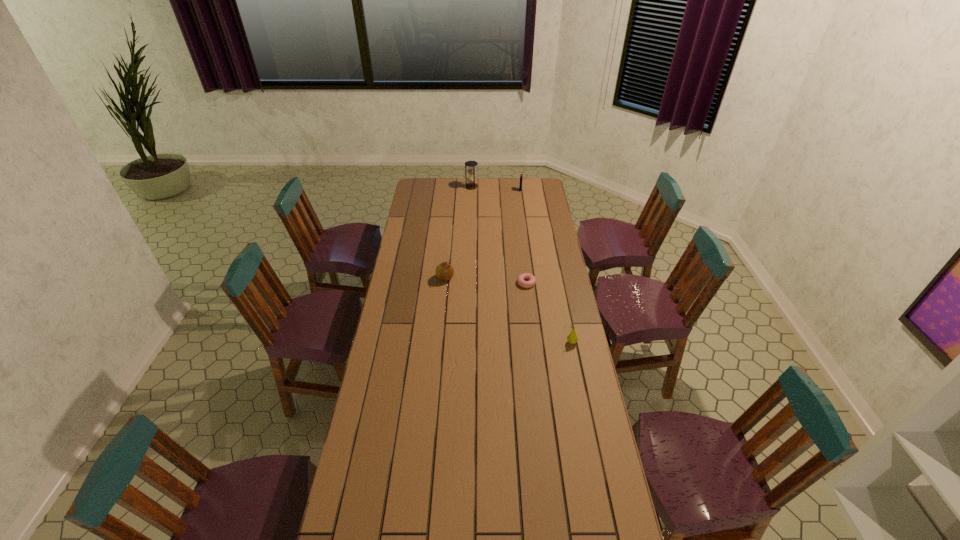
Find the location of a particular element. This screenshot has width=960, height=540. blank area located on the front of the taller pear is located at coordinates (444, 298).

At what (x,y) coordinates should I click in order to perform the action: click on vacant space situated on the back of the shorter pear. Please return your answer as a coordinate pair (x, y). Looking at the image, I should click on (564, 305).

The height and width of the screenshot is (540, 960). In order to click on vacant space situated 0.100m on the front of the doughnut in this screenshot , I will do `click(529, 304)`.

You are a GUI agent. You are given a task and a screenshot of the screen. Output one action in this format:
    pyautogui.click(x=<x>, y=<y>)
    Task: Click on the hourglass situated at the far edge
    The image size is (960, 540).
    Given the screenshot: What is the action you would take?
    pyautogui.click(x=471, y=184)

The width and height of the screenshot is (960, 540). What are the coordinates of `igniter located in the far edge section of the desktop` in the screenshot? It's located at click(x=521, y=174).

Find the location of a particular element. The width and height of the screenshot is (960, 540). igniter that is at the right edge is located at coordinates (521, 174).

Locate an element on the screen. The width and height of the screenshot is (960, 540). pear present at the right edge is located at coordinates (572, 338).

The image size is (960, 540). In order to click on doughnut located at the right edge in this screenshot , I will do `click(521, 278)`.

What are the coordinates of `object present at the far right corner` in the screenshot? It's located at (521, 174).

Where is `vacant space at the far edge of the desktop`? The height and width of the screenshot is (540, 960). vacant space at the far edge of the desktop is located at coordinates (460, 191).